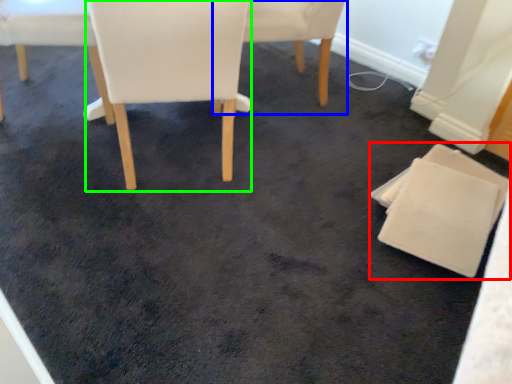
Question: Based on their relative distances, which object is farther from chair (highlighted by a red box)? Choose from chair (highlighted by a blue box) and chair (highlighted by a green box).

Choices:
 (A) chair
 (B) chair

Answer: (A)